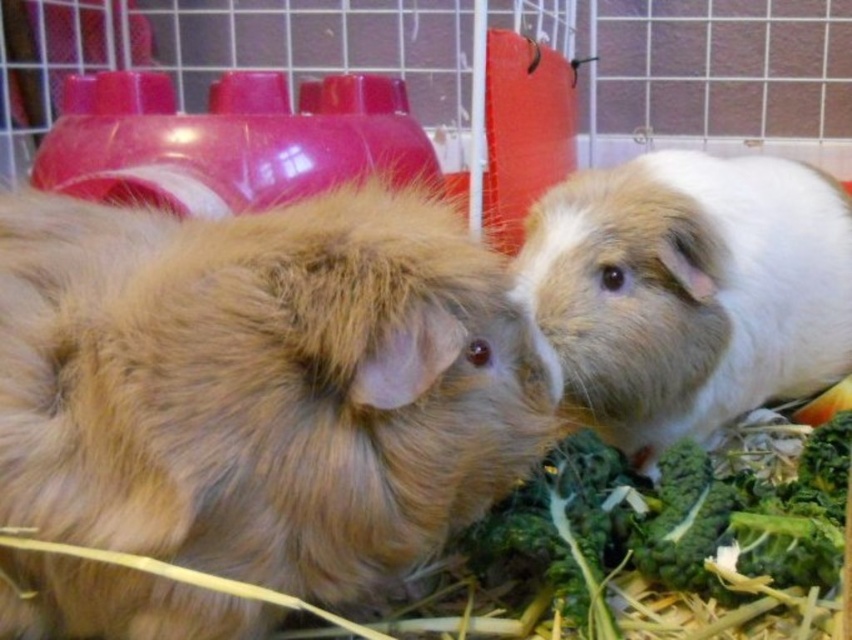
You are a veterinarian examining two guinea pigs in a cage. You notice the fuzzy brown hamster at center and the white soft hamster at center. Which one is shorter in height?

The fuzzy brown hamster at center is not as tall as the white soft hamster at center, so the fuzzy brown hamster at center is shorter in height.

You are a pet owner who wants to feed your guinea pigs. You have a white soft hamster at center and a green leafy broccoli at lower right. Which object is located to the right of the other?

The white soft hamster at center is positioned on the right side of green leafy broccoli at lower right.

You are a researcher studying guinea pigs in their habitat. You notice a point marked at coordinates [263,384]. What is located at this point?

The point at coordinates [263,384] marks the location of the fuzzy brown hamster at center.